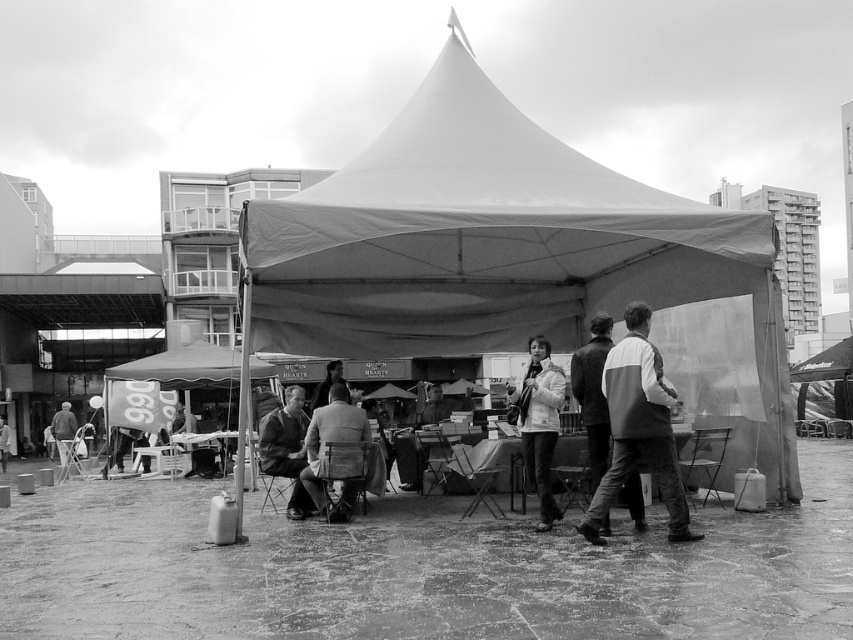
You are a vendor at the Queen Hearts market and need to place a 3.5 feet wide box between the white fabric jacket at center and the white textured coat at center. Can you fit the box in the space between them?

The white fabric jacket at center and white textured coat at center are 4.20 feet apart. Since the box is 3.5 feet wide, it can fit between them as there is enough space.